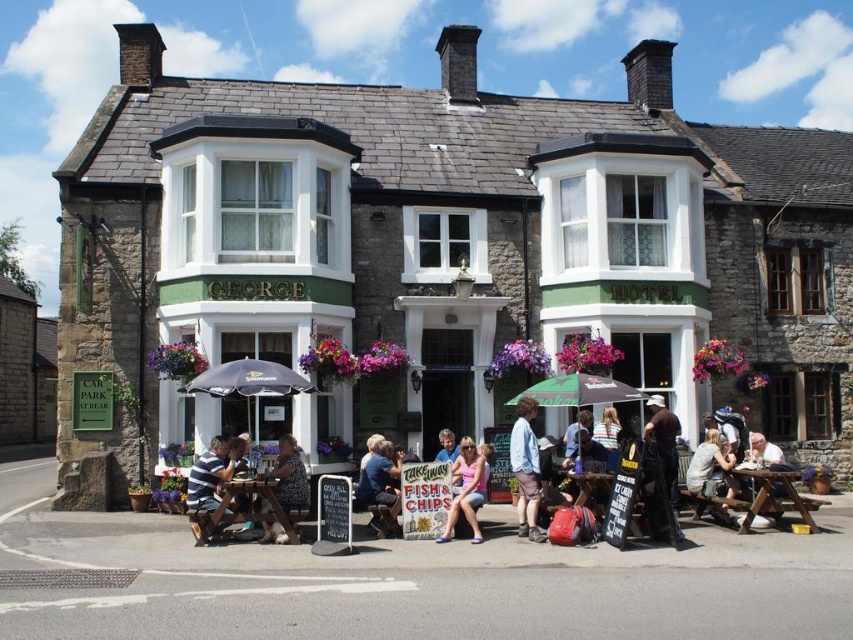
You are a guest at the hotel and want to retrieve your brown leather jacket at center from the outdoor seating area. The green fabric umbrella at center is currently blocking your path. Can you reach your jacket without moving the umbrella?

The brown leather jacket at center is behind the green fabric umbrella at center, so you can reach it by going around the umbrella or bending down to retrieve it without moving the umbrella.